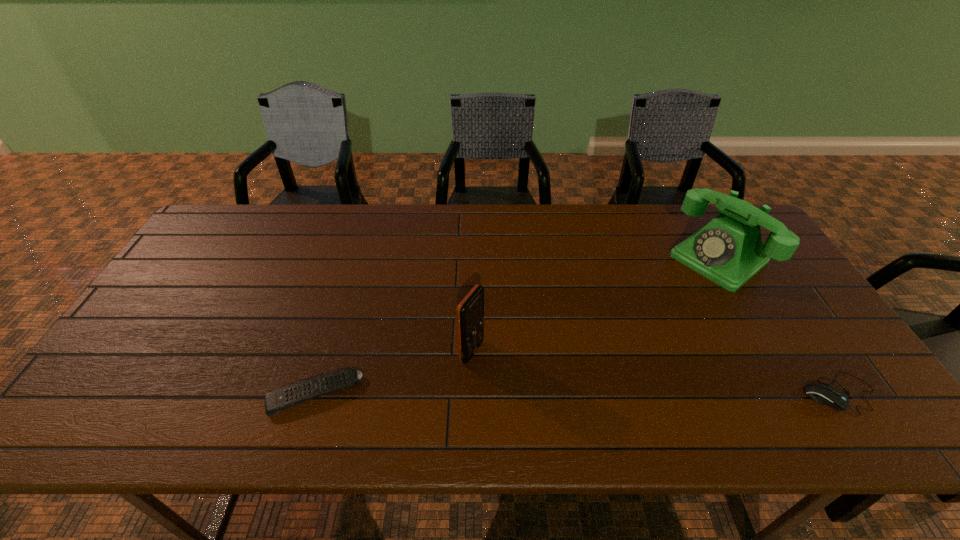
Identify the location of free space located 0.350m on the dial of the telephone. pos(615,338).

This screenshot has height=540, width=960. Identify the location of vacant region located on the screen of the cellular telephone. (511, 373).

The width and height of the screenshot is (960, 540). In order to click on vacant space situated 0.190m on the screen of the cellular telephone in this screenshot , I will do `click(553, 394)`.

Where is `vacant space situated 0.210m on the screen of the cellular telephone`? vacant space situated 0.210m on the screen of the cellular telephone is located at coordinates click(x=561, y=397).

At what (x,y) coordinates should I click in order to perform the action: click on object located at the far edge. Please return your answer as a coordinate pair (x, y). Looking at the image, I should click on (729, 251).

Image resolution: width=960 pixels, height=540 pixels. Find the location of `remote control positioned at the near edge`. remote control positioned at the near edge is located at coordinates (278, 400).

Where is `computer mouse at the near edge`? computer mouse at the near edge is located at coordinates (833, 397).

Where is `computer mouse positioned at the right edge`? computer mouse positioned at the right edge is located at coordinates (833, 397).

The image size is (960, 540). What are the coordinates of `telephone that is at the right edge` in the screenshot? It's located at (729, 251).

I want to click on object at the far right corner, so click(x=729, y=251).